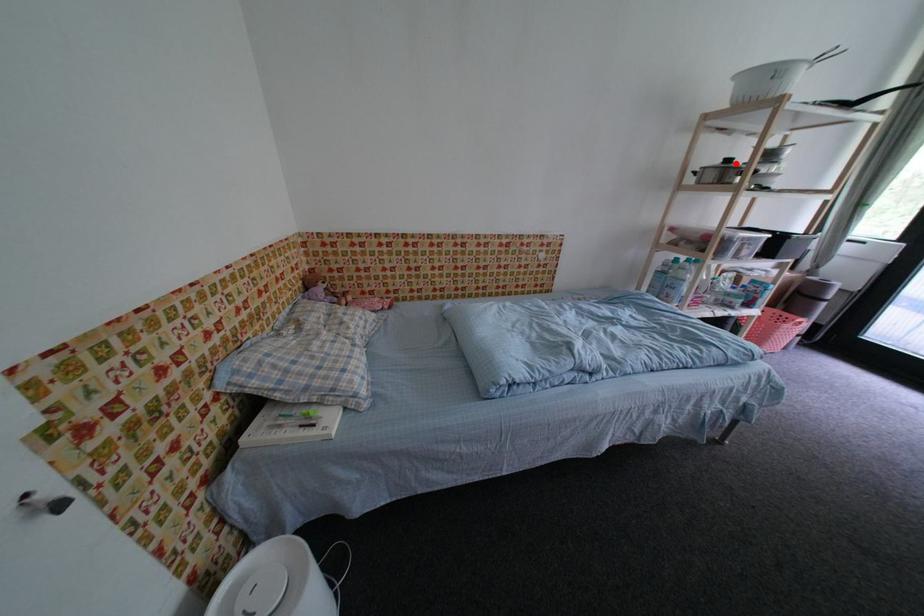
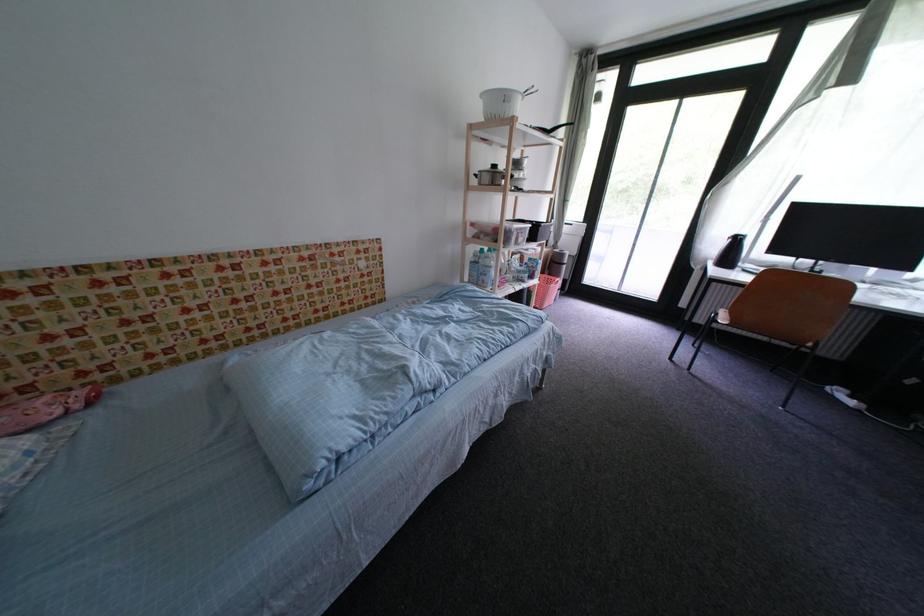
Question: I am providing you with two images of the same scene from different viewpoints. A red point is shown in image1. For the corresponding object point in image2, is it positioned nearer or farther from the camera?

Choices:
 (A) Nearer
 (B) Farther

Answer: (A)